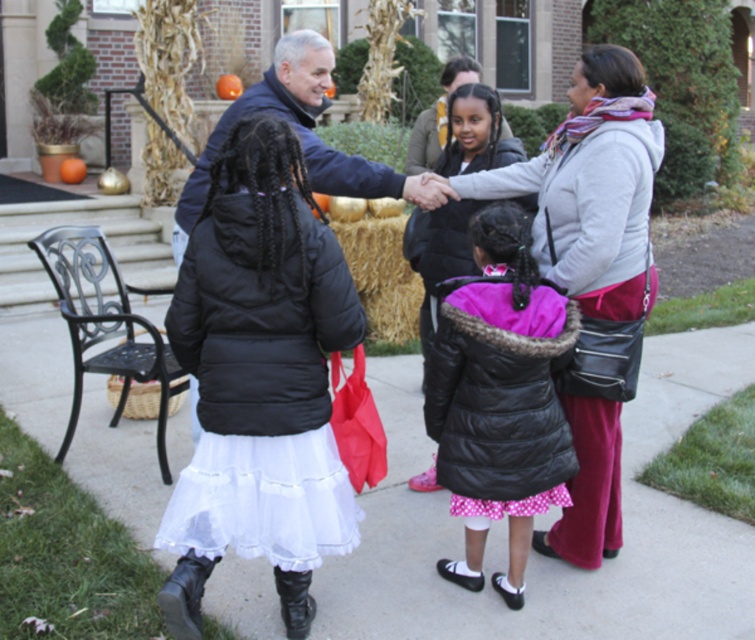
You are standing in the outdoor scene and want to take a photo of the two points. Which point, point (509, 192) or point (538, 392), is closer to the camera?

Point (509, 192) is closer to the camera than point (538, 392).

You are standing at the center of the image and see the black matte jacket at center. Which direction should you move to get closer to the point marked at coordinates (259, 380)?

The point marked at coordinates (259, 380) indicates the location of the black matte jacket at center. Since you are already at the center, moving towards that point would mean staying in the same spot as the jacket is already at the center.

Consider the image. You are a photographer trying to capture a clear shot of both the black matte jacket at center and the matte black jacket at center. Since they are both in the center, which one is closer to the camera?

The black matte jacket at center is positioned under the matte black jacket at center, so the matte black jacket at center is closer to the camera.